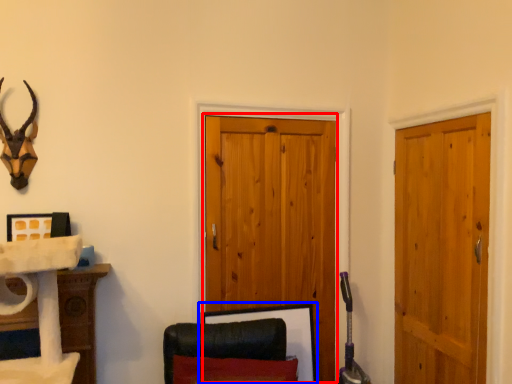
Question: Among these objects, which one is farthest to the camera, barn door (highlighted by a red box) or picture frame (highlighted by a blue box)?

Choices:
 (A) barn door
 (B) picture frame

Answer: (A)